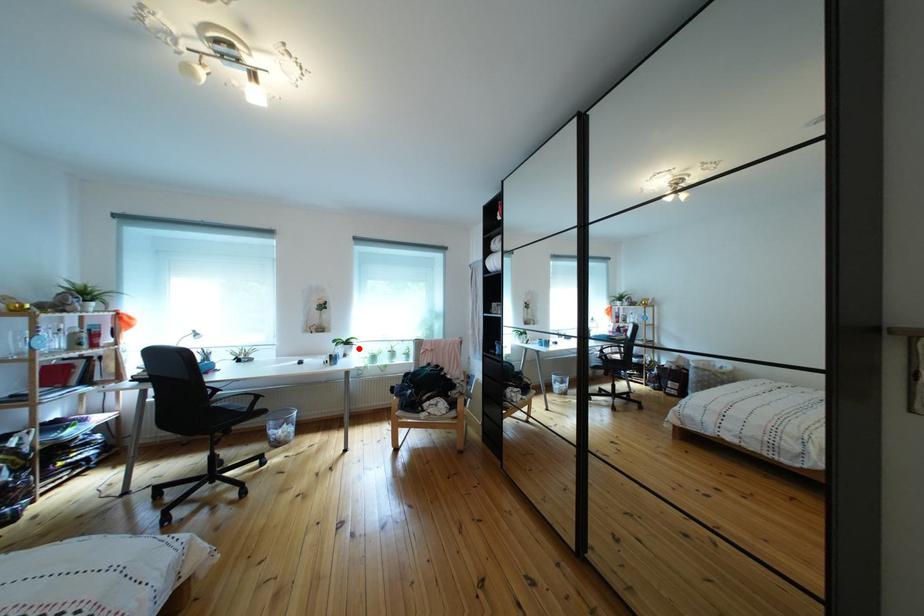
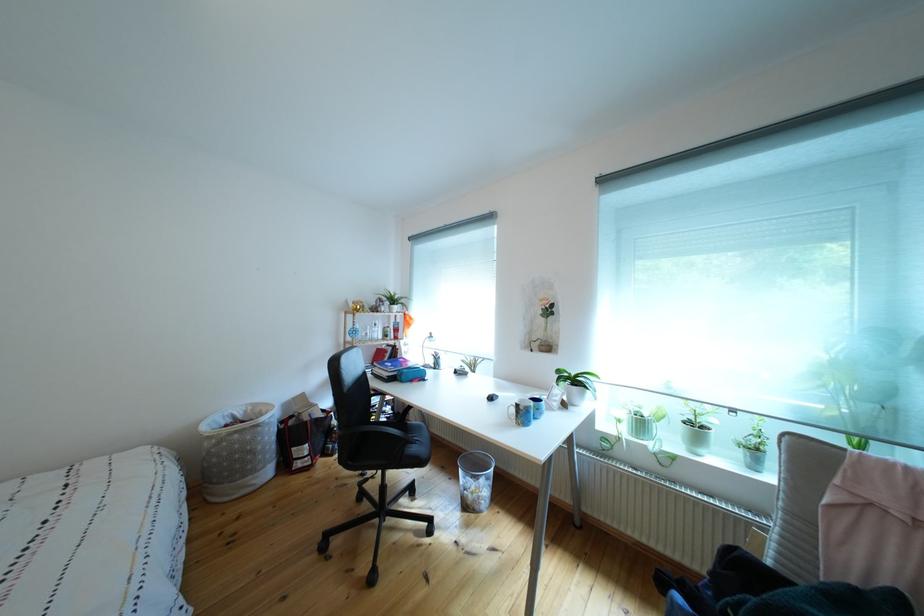
Question: I am providing you with two images of the same scene from different viewpoints. Image1 has a red point marked. In image2, the corresponding 3D location appears at what relative position? Reply with the corresponding letter.

Choices:
 (A) Closer
 (B) Farther

Answer: (B)